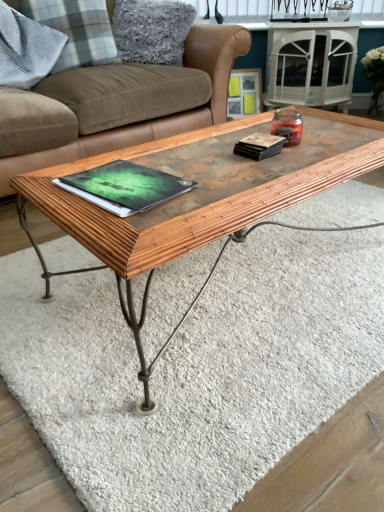
In order to face wooden picture frame at upper center, should I rotate leftwards or rightwards?

To align with it, rotate right about 7.126°.

Measure the distance between gray plaid pillow at upper left, the second pillow from the left, and camera.

gray plaid pillow at upper left, the second pillow from the left, and camera are 2.12 meters apart from each other.

This screenshot has height=512, width=384. What do you see at coordinates (125, 187) in the screenshot?
I see `green matte book at center, arranged as the first book when ordered from the bottom` at bounding box center [125, 187].

Describe the element at coordinates (26, 49) in the screenshot. I see `gray plaid pillow at upper left, positioned as the first pillow in left-to-right order` at that location.

I want to click on white glossy side table at upper center, so click(311, 66).

How many degrees apart are the facing directions of fluffy gray pillow at upper left, the first pillow in the right-to-left sequence, and white glossy side table at upper center?

They differ by 12.3 degrees in their facing directions.

Which is nearer, (148,24) or (287,81)?

The point (148,24) is closer to the camera.

Is fluffy gray pillow at upper left, the first pillow in the right-to-left sequence, not inside white glossy side table at upper center?

Yes, fluffy gray pillow at upper left, the first pillow in the right-to-left sequence, is outside of white glossy side table at upper center.

How far apart are fluffy gray pillow at upper left, marked as the third pillow in a left-to-right arrangement, and white glossy side table at upper center?

A distance of 93.01 centimeters exists between fluffy gray pillow at upper left, marked as the third pillow in a left-to-right arrangement, and white glossy side table at upper center.

Which object is positioned more to the left, green matte book at center, which appears as the 2th book when viewed from the top, or white glossy side table at upper center?

Positioned to the left is green matte book at center, which appears as the 2th book when viewed from the top.

From their relative heights in the image, would you say green matte book at center, acting as the first book starting from the left, is taller or shorter than white glossy side table at upper center?

green matte book at center, acting as the first book starting from the left, is shorter than white glossy side table at upper center.

Which is correct: green matte book at center, acting as the first book starting from the left, is inside white glossy side table at upper center, or outside of it?

green matte book at center, acting as the first book starting from the left, is outside white glossy side table at upper center.

How far apart are green matte book at center, acting as the first book starting from the left, and white glossy side table at upper center?

green matte book at center, acting as the first book starting from the left, and white glossy side table at upper center are 7.38 feet apart from each other.

From the image's perspective, relative to white glossy side table at upper center, is brown leather couch at center above or below?

brown leather couch at center is below white glossy side table at upper center.

In the scene shown: Is brown leather couch at center oriented away from white glossy side table at upper center?

No, brown leather couch at center is not facing the opposite direction of white glossy side table at upper center.

Would you say brown leather couch at center is inside or outside white glossy side table at upper center?

brown leather couch at center is not enclosed by white glossy side table at upper center.

Is brown leather couch at center touching white glossy side table at upper center?

They are not placed beside each other.

Is wooden picture frame at upper center to the left of matte black book at upper right, acting as the first book starting from the top, from the viewer's perspective?

No.

Is wooden picture frame at upper center oriented away from matte black book at upper right, acting as the first book starting from the top?

No.

Who is shorter, wooden picture frame at upper center or matte black book at upper right, acting as the first book starting from the top?

Standing shorter between the two is matte black book at upper right, acting as the first book starting from the top.

From the image's perspective, which is below, wooden picture frame at upper center or matte black book at upper right, acting as the second book starting from the left?

matte black book at upper right, acting as the second book starting from the left.

Is point (234, 152) less distant than point (319, 89)?

That is True.

Considering the relative sizes of matte black book at upper right, which is the 2th book in bottom-to-top order, and white glossy side table at upper center in the image provided, is matte black book at upper right, which is the 2th book in bottom-to-top order, smaller than white glossy side table at upper center?

Correct, matte black book at upper right, which is the 2th book in bottom-to-top order, occupies less space than white glossy side table at upper center.

Which is more to the right, matte black book at upper right, acting as the second book starting from the left, or white glossy side table at upper center?

Positioned to the right is white glossy side table at upper center.

This screenshot has width=384, height=512. In order to click on side table behind the matte black book at upper right, which is counted as the first book, starting from the right in this screenshot , I will do `click(311, 66)`.

Looking at this image, can you confirm if wooden textured coffee table at center is taller than white glossy side table at upper center?

In fact, wooden textured coffee table at center may be shorter than white glossy side table at upper center.

Is wooden textured coffee table at center to the right of white glossy side table at upper center from the viewer's perspective?

In fact, wooden textured coffee table at center is to the left of white glossy side table at upper center.

Locate an element on the screen. coffee table lying below the white glossy side table at upper center (from the image's perspective) is located at coordinates (203, 195).

Is wooden picture frame at upper center turned away from gray plaid pillow at upper left, which is the 3th pillow in right-to-left order?

No.

From a real-world perspective, is wooden picture frame at upper center positioned above or below gray plaid pillow at upper left, positioned as the first pillow in left-to-right order?

From a real-world perspective, wooden picture frame at upper center is physically below gray plaid pillow at upper left, positioned as the first pillow in left-to-right order.

How far apart are wooden picture frame at upper center and gray plaid pillow at upper left, positioned as the first pillow in left-to-right order?

4.63 feet.

Does wooden picture frame at upper center have a greater height compared to gray plaid pillow at upper left, positioned as the first pillow in left-to-right order?

No.

Which pillow is the 1st one when counting from the front of the white glossy side table at upper center? Please provide its 2D coordinates.

[(151, 30)]

From the image's perspective, starting from the white glossy side table at upper center, which book is the 2nd one below? Please provide its 2D coordinates.

[(125, 187)]

From the image, which object appears to be farther from wooden textured coffee table at center, white glossy side table at upper center or gray plaid pillow at upper left, the second pillow when ordered from right to left?

Based on the image, white glossy side table at upper center appears to be further to wooden textured coffee table at center.

Based on their spatial positions, is brown leather couch at center or matte black book at upper right, which is counted as the first book, starting from the right, closer to wooden textured coffee table at center?

matte black book at upper right, which is counted as the first book, starting from the right, lies closer to wooden textured coffee table at center than the other object.

Which object lies further to the anchor point gray plaid pillow at upper left, the second pillow from the left, wooden textured coffee table at center or gray plaid pillow at upper left, positioned as the first pillow in left-to-right order?

wooden textured coffee table at center.

Which object lies further to the anchor point gray plaid pillow at upper left, the second pillow when ordered from right to left, brown leather couch at center or green matte book at center, acting as the first book starting from the left?

green matte book at center, acting as the first book starting from the left, lies further to gray plaid pillow at upper left, the second pillow when ordered from right to left, than the other object.

Estimate the real-world distances between objects in this image. Which object is further from gray plaid pillow at upper left, which is the 3th pillow in right-to-left order, white glossy side table at upper center or brown leather couch at center?

white glossy side table at upper center is positioned further to the anchor gray plaid pillow at upper left, which is the 3th pillow in right-to-left order.

When comparing their distances from green matte book at center, arranged as the first book when ordered from the bottom, does fluffy gray pillow at upper left, marked as the third pillow in a left-to-right arrangement, or gray plaid pillow at upper left, positioned as the first pillow in left-to-right order, seem further?

The object further to green matte book at center, arranged as the first book when ordered from the bottom, is fluffy gray pillow at upper left, marked as the third pillow in a left-to-right arrangement.

Looking at the image, which one is located further to brown leather couch at center, gray plaid pillow at upper left, the second pillow when ordered from right to left, or gray plaid pillow at upper left, positioned as the first pillow in left-to-right order?

gray plaid pillow at upper left, positioned as the first pillow in left-to-right order, lies further to brown leather couch at center than the other object.

From the image, which object appears to be nearer to wooden textured coffee table at center, brown leather couch at center or gray plaid pillow at upper left, the second pillow from the left?

Among the two, brown leather couch at center is located nearer to wooden textured coffee table at center.

What are the coordinates of `pillow located between gray plaid pillow at upper left, which is the 3th pillow in right-to-left order, and fluffy gray pillow at upper left, the first pillow in the right-to-left sequence, in the left-right direction` in the screenshot? It's located at (76, 30).

Where is `book between gray plaid pillow at upper left, which is the 3th pillow in right-to-left order, and matte black book at upper right, which is the 2th book in bottom-to-top order`? book between gray plaid pillow at upper left, which is the 3th pillow in right-to-left order, and matte black book at upper right, which is the 2th book in bottom-to-top order is located at coordinates (125, 187).

Locate an element on the screen. The image size is (384, 512). studio couch between wooden textured coffee table at center and gray plaid pillow at upper left, the second pillow from the left, from front to back is located at coordinates (108, 106).

Locate an element on the screen. studio couch positioned between green matte book at center, placed as the 2th book when sorted from right to left, and white glossy side table at upper center from near to far is located at coordinates (108, 106).